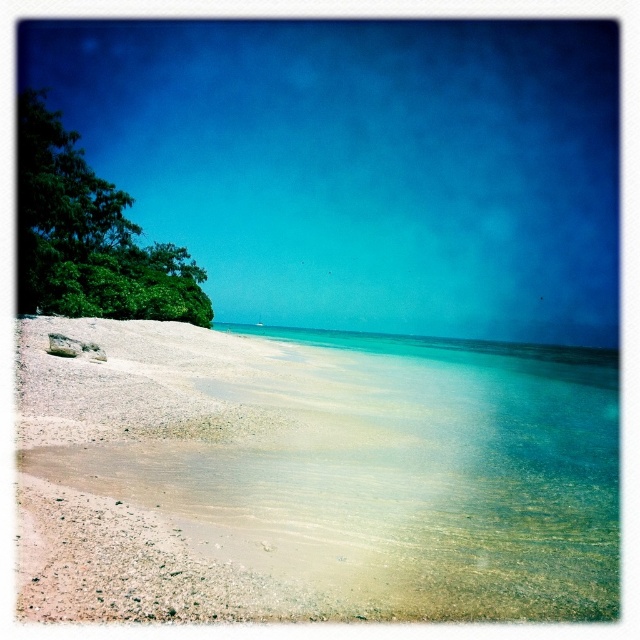
Question: Does sandy beach at lower left appear over green leafy tree at left?

Choices:
 (A) no
 (B) yes

Answer: (A)

Question: Which of the following is the farthest from the observer?

Choices:
 (A) (35, 291)
 (B) (438, 605)

Answer: (A)

Question: Can you confirm if sandy beach at lower left is bigger than green leafy tree at left?

Choices:
 (A) no
 (B) yes

Answer: (B)

Question: Which object appears farthest from the camera in this image?

Choices:
 (A) sandy beach at lower left
 (B) green leafy tree at left

Answer: (B)

Question: Where is sandy beach at lower left located in relation to green leafy tree at left in the image?

Choices:
 (A) left
 (B) right

Answer: (B)

Question: Which object is closer to the camera taking this photo?

Choices:
 (A) green leafy tree at left
 (B) sandy beach at lower left

Answer: (B)